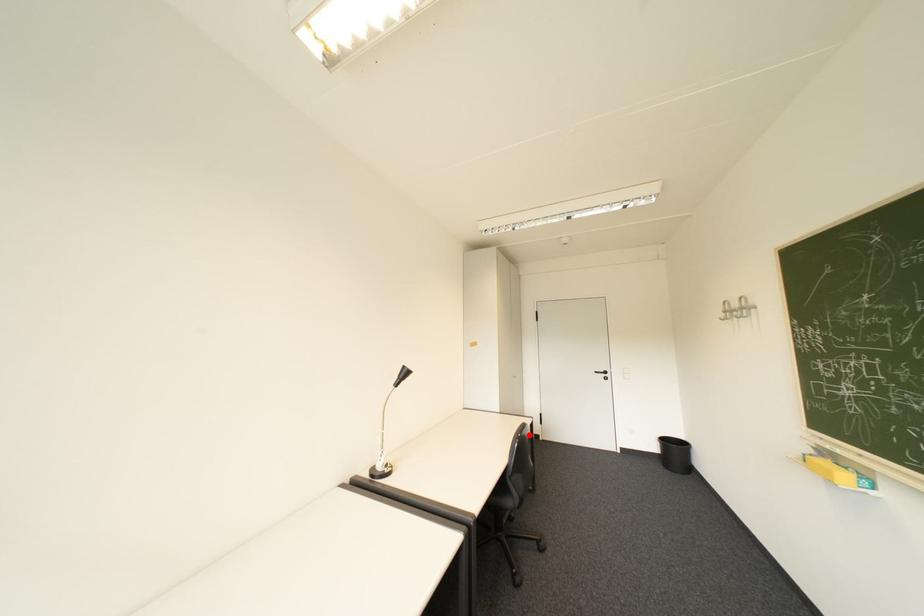
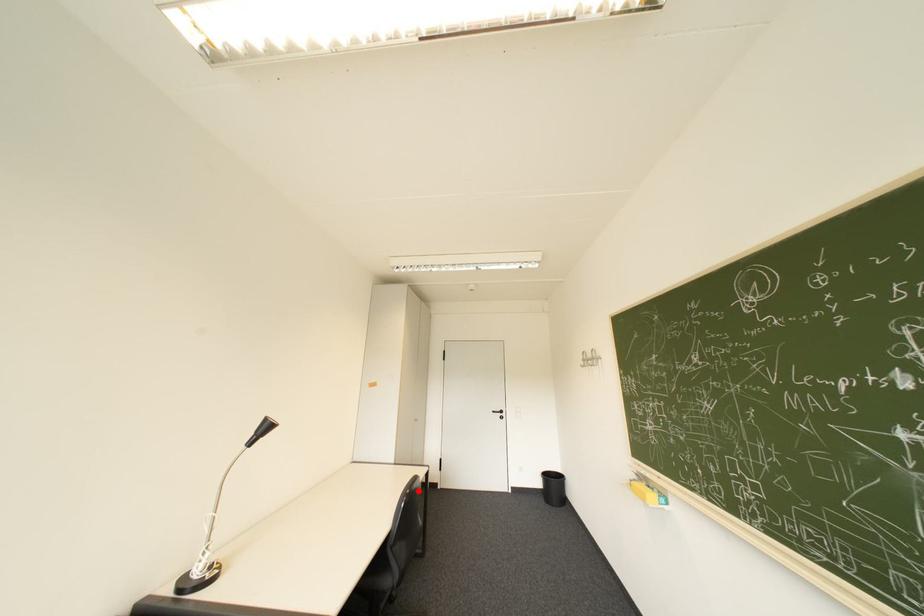
I am providing you with two images of the same scene from different viewpoints. A red point is marked on the first image and another point is marked on the second image. Is the red point in image1 aligned with the point shown in image2?

Yes